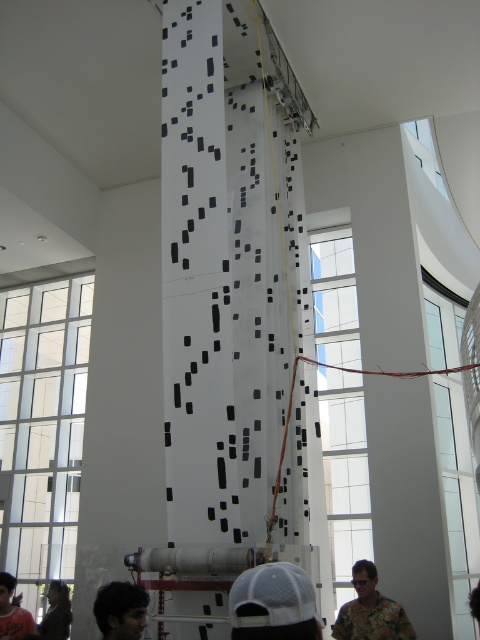
Which of these two, white mesh cap at center or hawaiian shirt at lower right, stands taller?

hawaiian shirt at lower right

Between white mesh cap at center and hawaiian shirt at lower right, which one is positioned higher?

Positioned higher is white mesh cap at center.

What do you see at coordinates (274, 604) in the screenshot? I see `white mesh cap at center` at bounding box center [274, 604].

You are a GUI agent. You are given a task and a screenshot of the screen. Output one action in this format:
    pyautogui.click(x=<x>, y=<y>)
    Task: Click on the white mesh cap at center
    
    Given the screenshot: What is the action you would take?
    pyautogui.click(x=274, y=604)

Which is more to the left, dark gray jacket at lower left or dark hair at lower right?

From the viewer's perspective, dark gray jacket at lower left appears more on the left side.

Is dark gray jacket at lower left below dark hair at lower right?

Indeed, dark gray jacket at lower left is positioned under dark hair at lower right.

Does point (61, 593) come closer to viewer compared to point (478, 600)?

No, (61, 593) is further to viewer.

This screenshot has height=640, width=480. Identify the location of dark gray jacket at lower left. (57, 612).

Based on the photo, can you confirm if hawaiian shirt at lower right is shorter than dark hair at lower left?

In fact, hawaiian shirt at lower right may be taller than dark hair at lower left.

Does point (359, 577) lie in front of point (122, 634)?

No, it is not.

You are a GUI agent. You are given a task and a screenshot of the screen. Output one action in this format:
    pyautogui.click(x=<x>, y=<y>)
    Task: Click on the hawaiian shirt at lower right
    This screenshot has width=480, height=640.
    Given the screenshot: What is the action you would take?
    pyautogui.click(x=371, y=611)